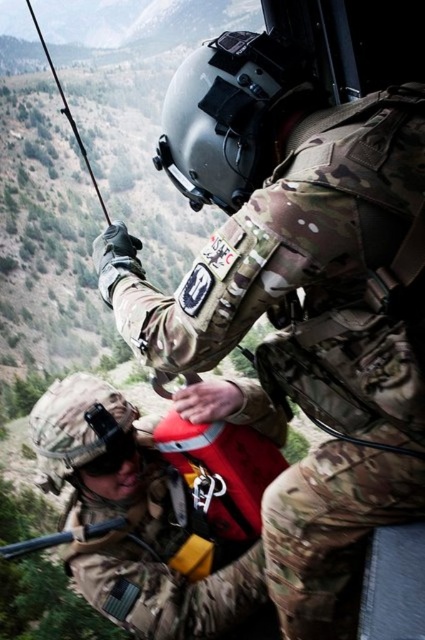
You are a soldier participating in a helicopter rescue mission. You need to retrieve an object located at point (339, 627). The rescue basket is currently 3.07 meters away from you. Can you safely reach the object with the basket?

The point (339, 627) is 3.07 meters from the viewer, so yes, the rescue basket can safely reach the object located at that point since it is within the basket

You are a drone operator controlling a camera drone. You need to capture a closeup shot of both point (320, 156) and point (95, 525) in the scene. Which point should you adjust the camera focus to first to ensure it is in focus?

Point (320, 156) should be focused on first because it is closer to the camera than point (95, 525). After focusing on point (320, 156), you can then adjust the focus to point (95, 525).

You are a military observer analyzing this scene. You notice the camouflage uniform at center and the matte black rifle at center. Which object is located to the right of the other?

The camouflage uniform at center is positioned on the right side of matte black rifle at center.